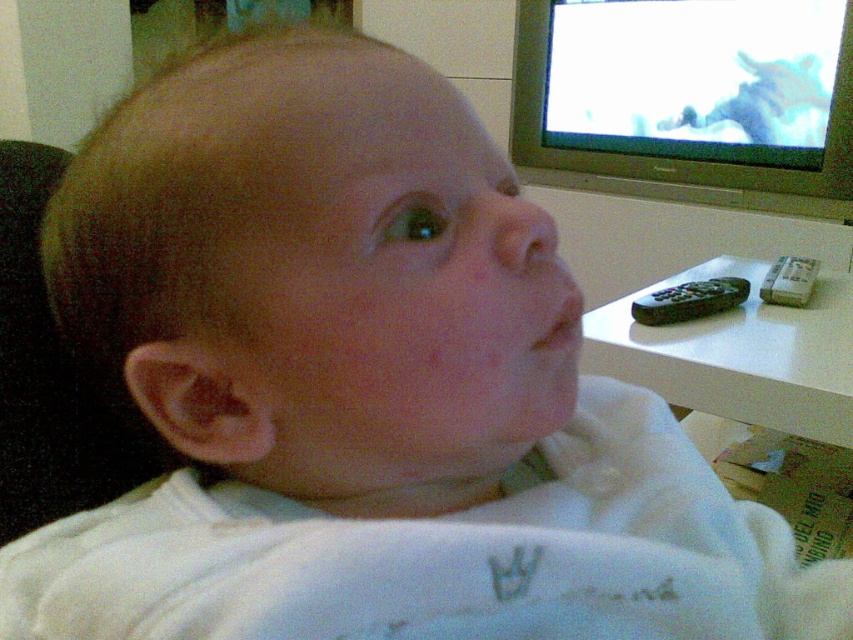
Question: Is silver plastic television at upper right thinner than black plastic remote at right?

Choices:
 (A) yes
 (B) no

Answer: (B)

Question: Among these objects, which one is nearest to the camera?

Choices:
 (A) gray plastic remote at right
 (B) silver plastic television at upper right

Answer: (A)

Question: Observing the image, what is the correct spatial positioning of black plastic remote at right in reference to gray plastic remote at right?

Choices:
 (A) above
 (B) below

Answer: (B)

Question: Which point is farther to the camera?

Choices:
 (A) silver plastic television at upper right
 (B) white plastic table at right
 (C) black plastic remote at right

Answer: (A)

Question: Which point is farther to the camera?

Choices:
 (A) (688, 291)
 (B) (773, 280)
 (C) (802, 348)

Answer: (B)

Question: Can you confirm if white plastic table at right is thinner than silver plastic television at upper right?

Choices:
 (A) yes
 (B) no

Answer: (A)